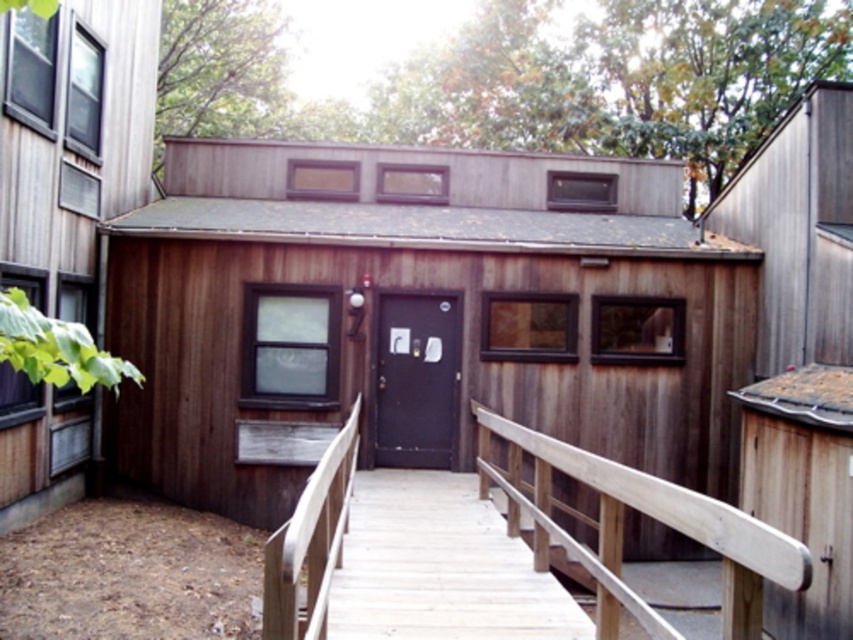
You are a person who is 1.8 meters tall and want to enter the building. The light brown wooden stairs at center and the black matte door at center are in your path. Can you walk through the space between them without bending down?

The light brown wooden stairs at center is 2.26 meters from the black matte door at center. Since you are 1.8 meters tall, the distance between them is sufficient for you to walk through without bending down as the space is wider than your height.

You are standing at the entrance of the shed and want to go to the point marked at coordinates (439, 566). Which direction should you walk to reach the light brown wooden stairs at center?

The point marked at coordinates (439, 566) is located on the light brown wooden stairs at center, so you should walk towards the center to reach it.